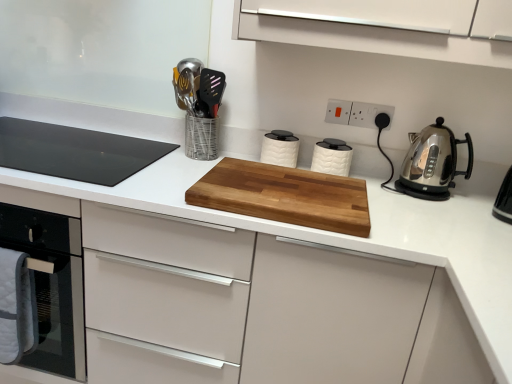
Question: Which direction should I rotate to face white plastic electric outlet at upper center, the 2th electric outlet positioned from the right, — up or down?

Choices:
 (A) down
 (B) up

Answer: (B)

Question: Is black glass cooktop at left positioned far away from white textured canister at center, positioned as the second kitchen appliance in right-to-left order?

Choices:
 (A) yes
 (B) no

Answer: (B)

Question: Is black glass cooktop at left positioned behind white textured canister at center, the second kitchen appliance from the left?

Choices:
 (A) yes
 (B) no

Answer: (B)

Question: Can you confirm if black glass cooktop at left is positioned to the right of white textured canister at center, the second kitchen appliance from the left?

Choices:
 (A) no
 (B) yes

Answer: (A)

Question: From the image's perspective, does black glass cooktop at left appear higher than white textured canister at center, the second kitchen appliance from the left?

Choices:
 (A) no
 (B) yes

Answer: (B)

Question: Is black glass cooktop at left not inside white textured canister at center, the second kitchen appliance from the left?

Choices:
 (A) no
 (B) yes

Answer: (B)

Question: Is black glass cooktop at left wider than white textured canister at center, the second kitchen appliance from the left?

Choices:
 (A) yes
 (B) no

Answer: (A)

Question: Does white textured canister at center, the first kitchen appliance in the left-to-right sequence, come behind metallic silver utensil holder at upper center?

Choices:
 (A) no
 (B) yes

Answer: (B)

Question: Does white textured canister at center, the third kitchen appliance positioned from the right, have a larger size compared to metallic silver utensil holder at upper center?

Choices:
 (A) yes
 (B) no

Answer: (B)

Question: Is white textured canister at center, the first kitchen appliance in the left-to-right sequence, smaller than metallic silver utensil holder at upper center?

Choices:
 (A) yes
 (B) no

Answer: (A)

Question: Is metallic silver utensil holder at upper center completely or partially inside white textured canister at center, the third kitchen appliance positioned from the right?

Choices:
 (A) yes
 (B) no

Answer: (B)

Question: Are white textured canister at center, the third kitchen appliance positioned from the right, and metallic silver utensil holder at upper center located far from each other?

Choices:
 (A) no
 (B) yes

Answer: (A)

Question: Considering the relative sizes of white textured canister at center, the third kitchen appliance positioned from the right, and metallic silver utensil holder at upper center in the image provided, is white textured canister at center, the third kitchen appliance positioned from the right, thinner than metallic silver utensil holder at upper center?

Choices:
 (A) no
 (B) yes

Answer: (B)

Question: From the image's perspective, is natural wood cutting board at center over white plastic electrical outlet at upper center, positioned as the second electric outlet in left-to-right order?

Choices:
 (A) no
 (B) yes

Answer: (A)